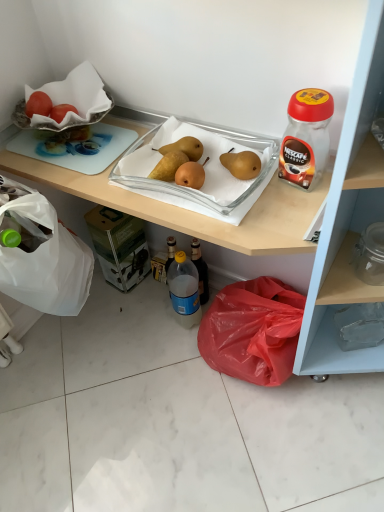
This screenshot has width=384, height=512. I want to click on vacant space in front of blue translucent bottle at center, the 2th bottle positioned from the top, so click(x=182, y=368).